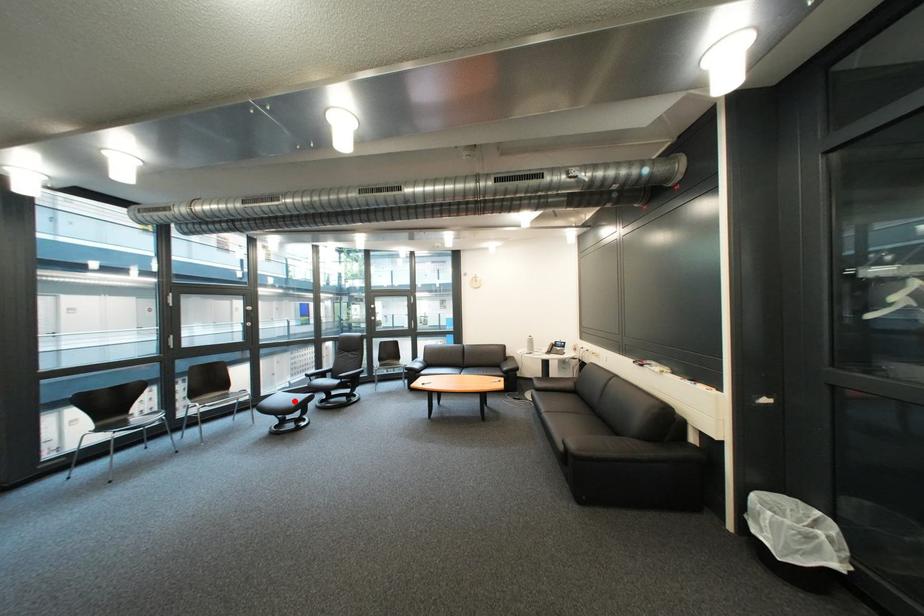
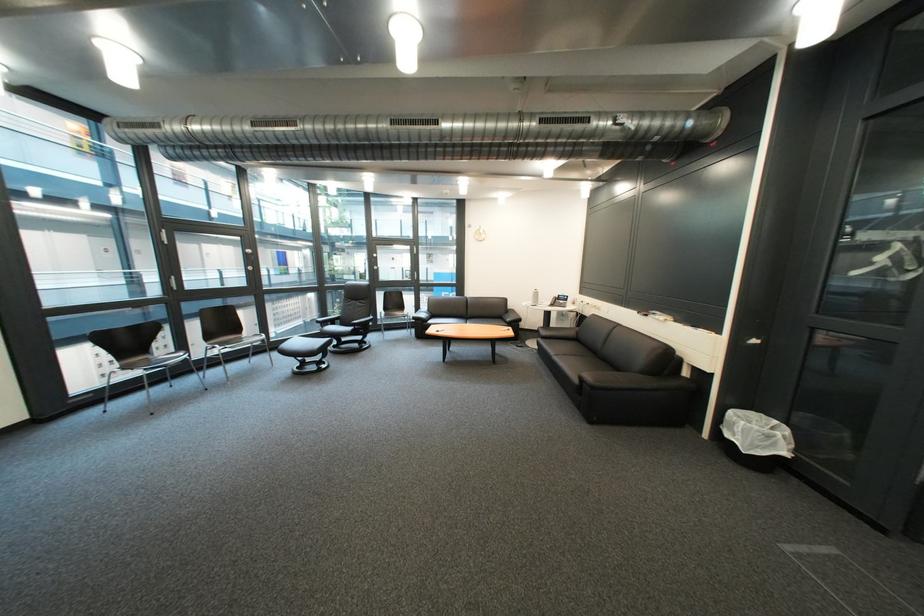
Where in the second image is the point corresponding to the highlighted location from the first image?

(311, 345)